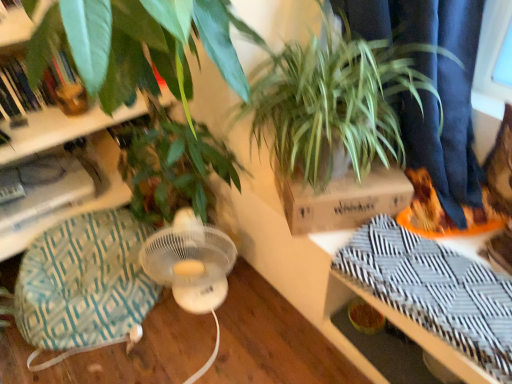
Question: From a real-world perspective, is green woven swivel chair at lower left on top of orange matte shoe at right?

Choices:
 (A) no
 (B) yes

Answer: (A)

Question: Can you confirm if green woven swivel chair at lower left is bigger than orange matte shoe at right?

Choices:
 (A) no
 (B) yes

Answer: (B)

Question: Is orange matte shoe at right at the back of green woven swivel chair at lower left?

Choices:
 (A) no
 (B) yes

Answer: (A)

Question: Can you confirm if green woven swivel chair at lower left is taller than orange matte shoe at right?

Choices:
 (A) yes
 (B) no

Answer: (A)

Question: From a real-world perspective, is green woven swivel chair at lower left under orange matte shoe at right?

Choices:
 (A) yes
 (B) no

Answer: (A)

Question: Is green woven swivel chair at lower left with orange matte shoe at right?

Choices:
 (A) yes
 (B) no

Answer: (B)

Question: Is brown cardboard box at upper center closer to camera compared to orange matte shoe at right?

Choices:
 (A) no
 (B) yes

Answer: (B)

Question: From the image's perspective, is brown cardboard box at upper center located beneath orange matte shoe at right?

Choices:
 (A) no
 (B) yes

Answer: (A)

Question: From a real-world perspective, is brown cardboard box at upper center on top of orange matte shoe at right?

Choices:
 (A) no
 (B) yes

Answer: (A)

Question: From the image's perspective, is brown cardboard box at upper center above orange matte shoe at right?

Choices:
 (A) no
 (B) yes

Answer: (B)

Question: Is brown cardboard box at upper center facing away from orange matte shoe at right?

Choices:
 (A) no
 (B) yes

Answer: (A)

Question: Is orange matte shoe at right inside brown cardboard box at upper center?

Choices:
 (A) no
 (B) yes

Answer: (A)

Question: From the image's perspective, is green leafy plant at upper right over green woven swivel chair at lower left?

Choices:
 (A) yes
 (B) no

Answer: (A)